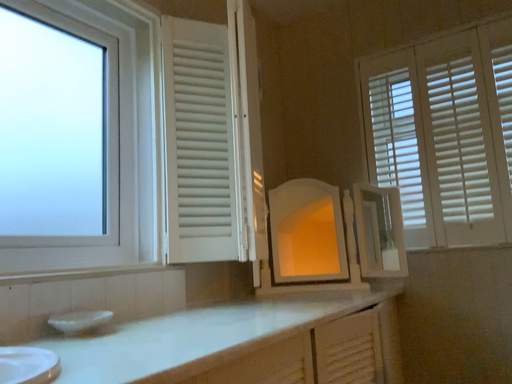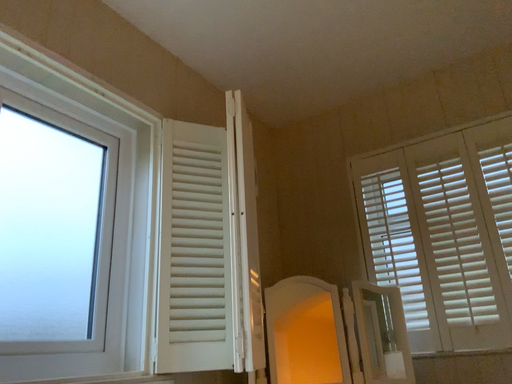
Question: Which way did the camera rotate in the video?

Choices:
 (A) rotated downward
 (B) rotated upward

Answer: (B)